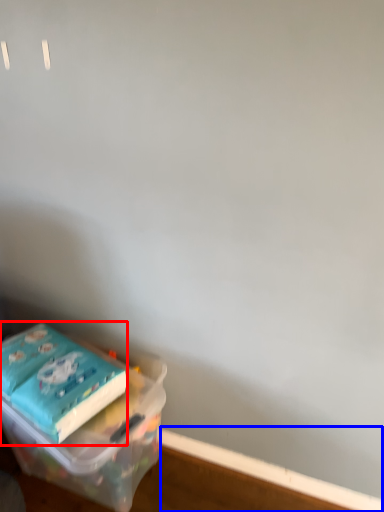
Question: Which point is closer to the camera, paperback book (highlighted by a red box) or window sill (highlighted by a blue box)?

Choices:
 (A) paperback book
 (B) window sill

Answer: (A)